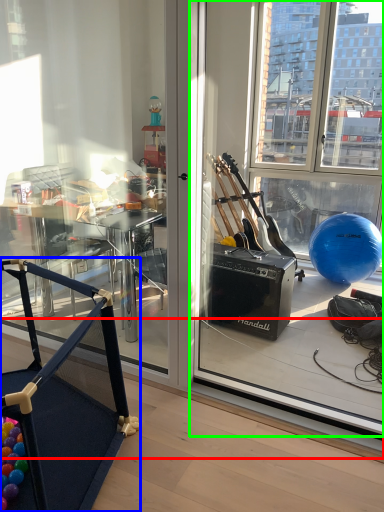
Question: Considering the real-world distances, which object is closest to window sill (highlighted by a red box)? furniture (highlighted by a blue box) or window screen (highlighted by a green box).

Choices:
 (A) furniture
 (B) window screen

Answer: (A)